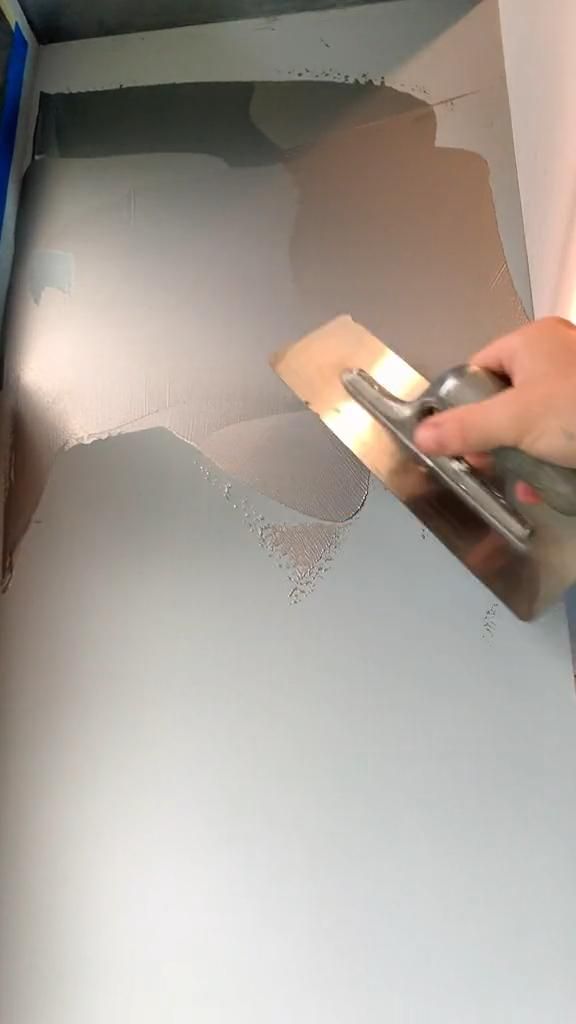
You are a GUI agent. You are given a task and a screenshot of the screen. Output one action in this format:
    pyautogui.click(x=<x>, y=<y>)
    Task: Click on the glossy mother of pearl painted surface
    Image resolution: width=576 pixels, height=1024 pixels.
    Given the screenshot: What is the action you would take?
    (74, 354), (236, 306), (386, 237), (290, 470), (74, 212)